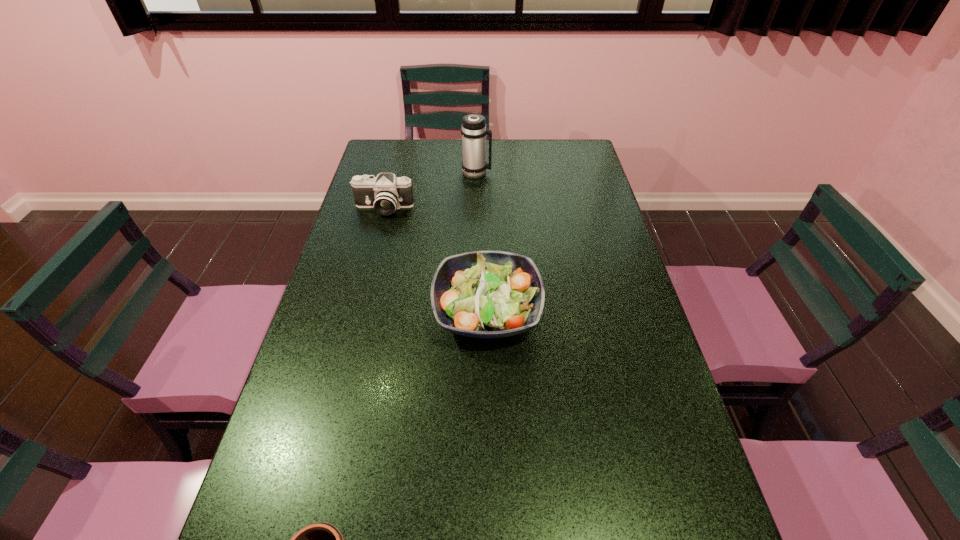
This screenshot has height=540, width=960. Find the location of `free space that satisfies the following two spatial constraints: 1. on the front side of the camera; 2. on the left side of the second nearest object`. free space that satisfies the following two spatial constraints: 1. on the front side of the camera; 2. on the left side of the second nearest object is located at coordinates pos(357,311).

The height and width of the screenshot is (540, 960). I want to click on free space that satisfies the following two spatial constraints: 1. on the side with the handle of the tallest object; 2. on the back side of the salad plate, so click(475, 311).